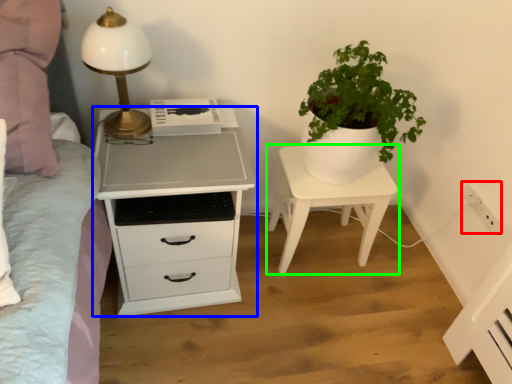
Question: Which object is positioned farthest from electric outlet (highlighted by a red box)? Select from chest of drawers (highlighted by a blue box) and nightstand (highlighted by a green box).

Choices:
 (A) chest of drawers
 (B) nightstand

Answer: (A)